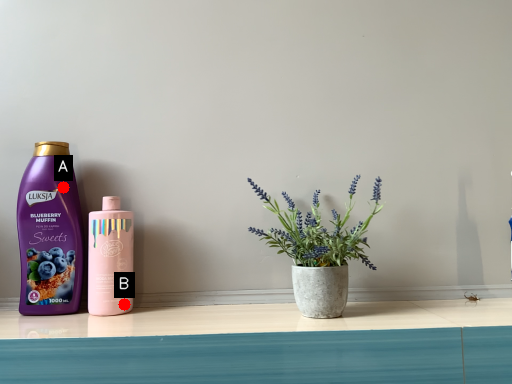
Question: Two points are circled on the image, labeled by A and B beside each circle. Which point is further to the camera?

Choices:
 (A) A is further
 (B) B is further

Answer: (A)